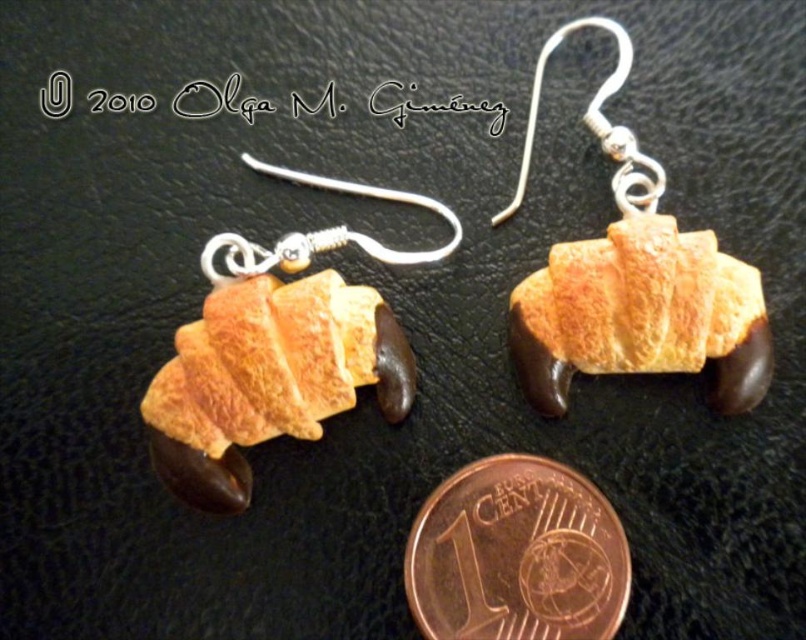
You are a jeweler who needs to place the copper metallic coin at lower center into a display case. The case has a grid system with coordinates from 0 to 1 on both axes. Where should you place the coin to match its position in the image?

Place the copper metallic coin at lower center at the coordinate point of 0.869 on the x axis and 0.641 on the y axis to match its position in the image.

You are a jeweler who wants to create a miniature version of the golden matte croissant at center so that it can be worn as an earring. The copper metallic coin at lower center is 1 Euro cent. Can the miniature croissant be smaller than the coin?

The golden matte croissant at center is currently larger than the copper metallic coin at lower center. To make a miniature version smaller than the coin, the jeweler would need to reduce its size below the current dimensions of the coin.